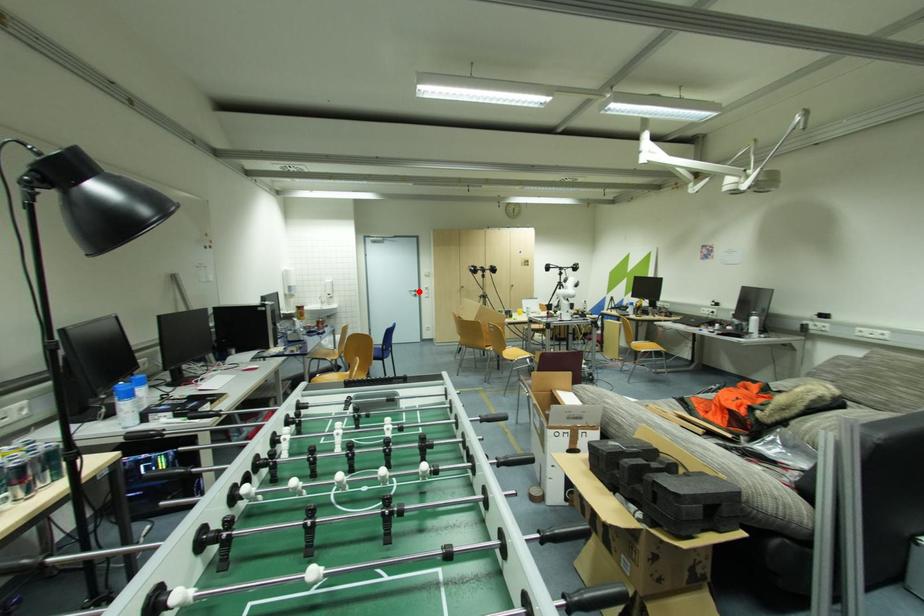
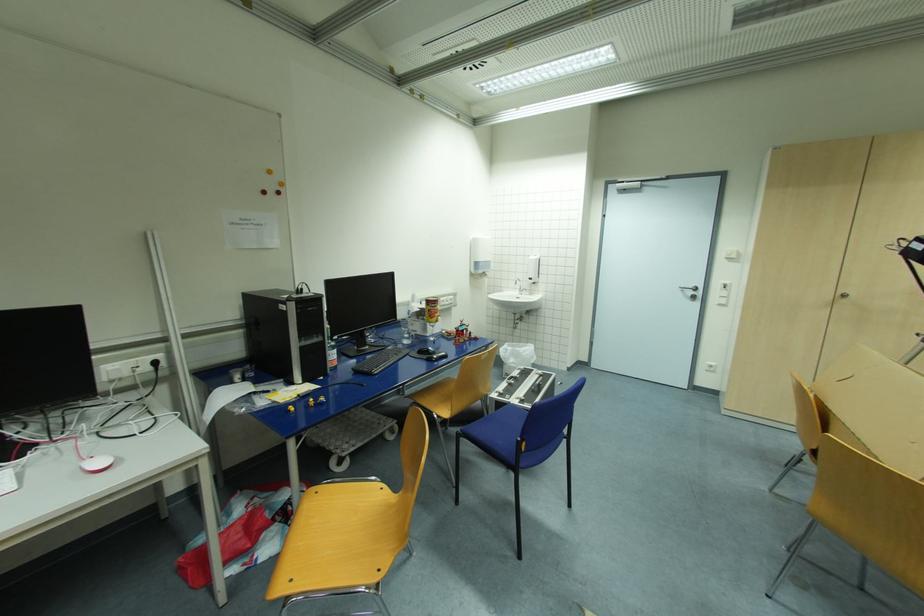
The point at the highlighted location is marked in the first image. Where is the corresponding point in the second image?

(699, 289)